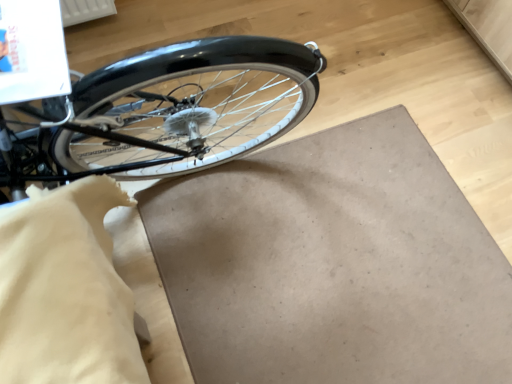
What are the coordinates of `vacant space behind brown cardboard at upper left` in the screenshot? It's located at (377, 73).